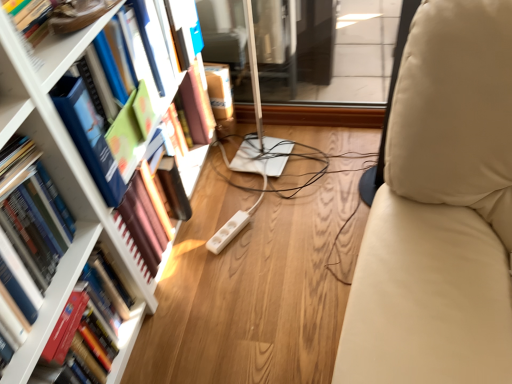
What do you see at coordinates (103, 317) in the screenshot? I see `hardcover book at left, positioned as the 1th book in bottom-to-top order` at bounding box center [103, 317].

Locate an element on the screen. The height and width of the screenshot is (384, 512). hardcover book at left, arranged as the second book when ordered from the bottom is located at coordinates (31, 223).

Based on the photo, would you say hardcover book at left, arranged as the second book when ordered from the bottom, is outside hardcover book at left, the first book viewed from the top?

Absolutely, hardcover book at left, arranged as the second book when ordered from the bottom, is external to hardcover book at left, the first book viewed from the top.

Does hardcover book at left, which is the second book in top-to-bottom order, turn towards hardcover book at left, the third book from the bottom?

No.

The image size is (512, 384). In order to click on book lying on the right of hardcover book at left, arranged as the second book when ordered from the bottom in this screenshot , I will do `click(102, 144)`.

Consider the image. Considering the relative sizes of hardcover book at left, which is the second book in top-to-bottom order, and hardcover book at left, the first book viewed from the top, in the image provided, is hardcover book at left, which is the second book in top-to-bottom order, wider than hardcover book at left, the first book viewed from the top,?

In fact, hardcover book at left, which is the second book in top-to-bottom order, might be narrower than hardcover book at left, the first book viewed from the top.

Between white glossy bookshelf at upper left and hardcover book at left, the first book viewed from the top, which one appears on the left side from the viewer's perspective?

white glossy bookshelf at upper left.

From the image's perspective, which is above, white glossy bookshelf at upper left or hardcover book at left, the third book from the bottom?

From the image's view, white glossy bookshelf at upper left is above.

Is the position of white glossy bookshelf at upper left more distant than that of hardcover book at left, the third book from the bottom?

No, the depth of white glossy bookshelf at upper left is less than that of hardcover book at left, the third book from the bottom.

Is the position of hardcover book at left, the third book from the bottom, more distant than that of white glossy bookshelf at upper left?

Yes, it is behind white glossy bookshelf at upper left.

Is hardcover book at left, the first book viewed from the top, facing towards white glossy bookshelf at upper left?

No, hardcover book at left, the first book viewed from the top, is not facing towards white glossy bookshelf at upper left.

Which is correct: hardcover book at left, the first book viewed from the top, is inside white glossy bookshelf at upper left, or outside of it?

hardcover book at left, the first book viewed from the top, is spatially situated outside white glossy bookshelf at upper left.

Between hardcover book at left, the 3th book in the top-to-bottom sequence, and hardcover book at left, the first book viewed from the top, which one has larger size?

With larger size is hardcover book at left, the first book viewed from the top.

From the image's perspective, does hardcover book at left, the 3th book in the top-to-bottom sequence, appear higher than hardcover book at left, the third book from the bottom?

Actually, hardcover book at left, the 3th book in the top-to-bottom sequence, appears below hardcover book at left, the third book from the bottom, in the image.

Is hardcover book at left, the 3th book in the top-to-bottom sequence, placed right next to hardcover book at left, the third book from the bottom?

No, hardcover book at left, the 3th book in the top-to-bottom sequence, is not touching hardcover book at left, the third book from the bottom.

Is hardcover book at left, positioned as the 1th book in bottom-to-top order, facing towards hardcover book at left, the first book viewed from the top?

No, hardcover book at left, positioned as the 1th book in bottom-to-top order, is not facing towards hardcover book at left, the first book viewed from the top.

Is hardcover book at left, arranged as the second book when ordered from the bottom, completely or partially outside of hardcover book at left, the 3th book in the top-to-bottom sequence?

Yes, hardcover book at left, arranged as the second book when ordered from the bottom, is not within hardcover book at left, the 3th book in the top-to-bottom sequence.

The height and width of the screenshot is (384, 512). What are the coordinates of `book below the hardcover book at left, which is the second book in top-to-bottom order (from a real-world perspective)` in the screenshot? It's located at (103, 317).

From the picture: Does hardcover book at left, arranged as the second book when ordered from the bottom, lie behind hardcover book at left, the 3th book in the top-to-bottom sequence?

No, it is not.

From a real-world perspective, is hardcover book at left, arranged as the second book when ordered from the bottom, located beneath hardcover book at left, positioned as the 1th book in bottom-to-top order?

No, from a real-world perspective, hardcover book at left, arranged as the second book when ordered from the bottom, is not below hardcover book at left, positioned as the 1th book in bottom-to-top order.

Where is `shelf behind the hardcover book at left, which is the second book in top-to-bottom order`? This screenshot has width=512, height=384. shelf behind the hardcover book at left, which is the second book in top-to-bottom order is located at coordinates (66, 49).

Considering the sizes of objects hardcover book at left, arranged as the second book when ordered from the bottom, and white glossy bookshelf at upper left in the image provided, who is bigger, hardcover book at left, arranged as the second book when ordered from the bottom, or white glossy bookshelf at upper left?

Bigger between the two is hardcover book at left, arranged as the second book when ordered from the bottom.

From a real-world perspective, which is physically above, hardcover book at left, which is the second book in top-to-bottom order, or white glossy bookshelf at upper left?

From a 3D spatial view, white glossy bookshelf at upper left is above.

Which object is closer to the camera taking this photo, hardcover book at left, arranged as the second book when ordered from the bottom, or white glossy bookshelf at upper left?

hardcover book at left, arranged as the second book when ordered from the bottom, is closer to the camera.

Could you measure the distance between hardcover book at left, the third book from the bottom, and hardcover book at left, positioned as the 1th book in bottom-to-top order?

They are 14.50 inches apart.

From the image's perspective, count 2nd books upward from the hardcover book at left, positioned as the 1th book in bottom-to-top order, and point to it. Please provide its 2D coordinates.

[(102, 144)]

Is hardcover book at left, the first book viewed from the top, bigger than hardcover book at left, positioned as the 1th book in bottom-to-top order?

Correct, hardcover book at left, the first book viewed from the top, is larger in size than hardcover book at left, positioned as the 1th book in bottom-to-top order.

Is hardcover book at left, the third book from the bottom, not close to hardcover book at left, positioned as the 1th book in bottom-to-top order?

No, hardcover book at left, the third book from the bottom, is in close proximity to hardcover book at left, positioned as the 1th book in bottom-to-top order.

The height and width of the screenshot is (384, 512). What are the coordinates of `book above the hardcover book at left, which is the second book in top-to-bottom order (from a real-world perspective)` in the screenshot? It's located at (102, 144).

Image resolution: width=512 pixels, height=384 pixels. In order to click on book to the right of white glossy bookshelf at upper left in this screenshot , I will do `click(102, 144)`.

Based on their spatial positions, is hardcover book at left, positioned as the 1th book in bottom-to-top order, or hardcover book at left, arranged as the second book when ordered from the bottom, closer to white glossy bookshelf at upper left?

hardcover book at left, arranged as the second book when ordered from the bottom, is positioned closer to the anchor white glossy bookshelf at upper left.

Considering their positions, is hardcover book at left, the first book viewed from the top, positioned further to hardcover book at left, positioned as the 1th book in bottom-to-top order, than white glossy bookshelf at upper left?

white glossy bookshelf at upper left is further to hardcover book at left, positioned as the 1th book in bottom-to-top order.

Which object lies nearer to the anchor point hardcover book at left, positioned as the 1th book in bottom-to-top order, hardcover book at left, which is the second book in top-to-bottom order, or hardcover book at left, the third book from the bottom?

Among the two, hardcover book at left, which is the second book in top-to-bottom order, is located nearer to hardcover book at left, positioned as the 1th book in bottom-to-top order.

Which object lies further to the anchor point hardcover book at left, the third book from the bottom, hardcover book at left, positioned as the 1th book in bottom-to-top order, or hardcover book at left, arranged as the second book when ordered from the bottom?

hardcover book at left, positioned as the 1th book in bottom-to-top order, is positioned further to the anchor hardcover book at left, the third book from the bottom.

When comparing their distances from hardcover book at left, arranged as the second book when ordered from the bottom, does hardcover book at left, the first book viewed from the top, or hardcover book at left, the 3th book in the top-to-bottom sequence, seem closer?

hardcover book at left, the 3th book in the top-to-bottom sequence, is closer to hardcover book at left, arranged as the second book when ordered from the bottom.

Based on their spatial positions, is hardcover book at left, the first book viewed from the top, or white glossy bookshelf at upper left closer to hardcover book at left, arranged as the second book when ordered from the bottom?

hardcover book at left, the first book viewed from the top, lies closer to hardcover book at left, arranged as the second book when ordered from the bottom, than the other object.

Which object lies further to the anchor point white glossy bookshelf at upper left, hardcover book at left, positioned as the 1th book in bottom-to-top order, or hardcover book at left, the first book viewed from the top?

hardcover book at left, positioned as the 1th book in bottom-to-top order, is further to white glossy bookshelf at upper left.

When comparing their distances from hardcover book at left, arranged as the second book when ordered from the bottom, does hardcover book at left, positioned as the 1th book in bottom-to-top order, or hardcover book at left, the third book from the bottom, seem further?

hardcover book at left, the third book from the bottom, is positioned further to the anchor hardcover book at left, arranged as the second book when ordered from the bottom.

The width and height of the screenshot is (512, 384). In order to click on book between white glossy bookshelf at upper left and hardcover book at left, arranged as the second book when ordered from the bottom, in the vertical direction in this screenshot , I will do `click(102, 144)`.

This screenshot has height=384, width=512. What are the coordinates of `book between hardcover book at left, the third book from the bottom, and hardcover book at left, the 3th book in the top-to-bottom sequence, in the vertical direction` in the screenshot? It's located at (31, 223).